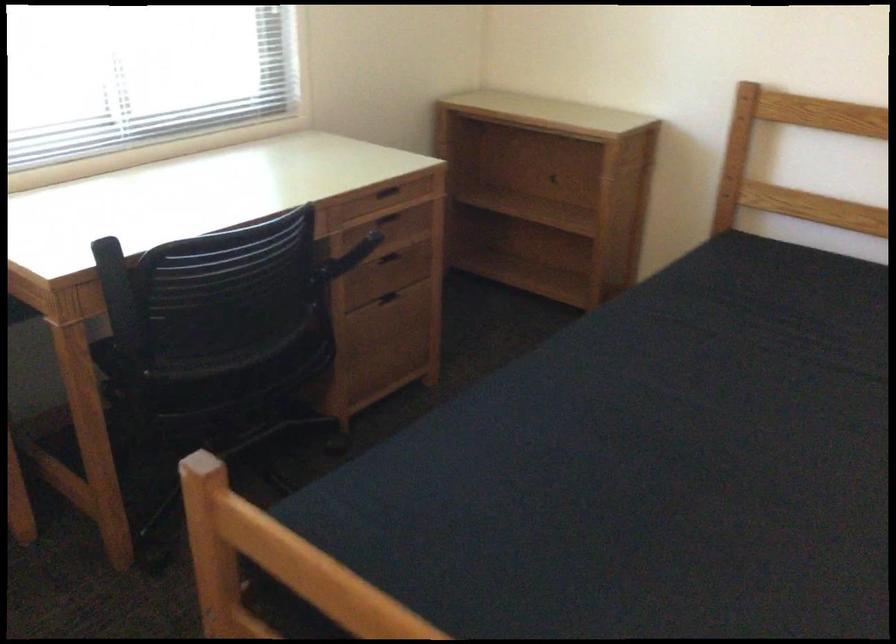
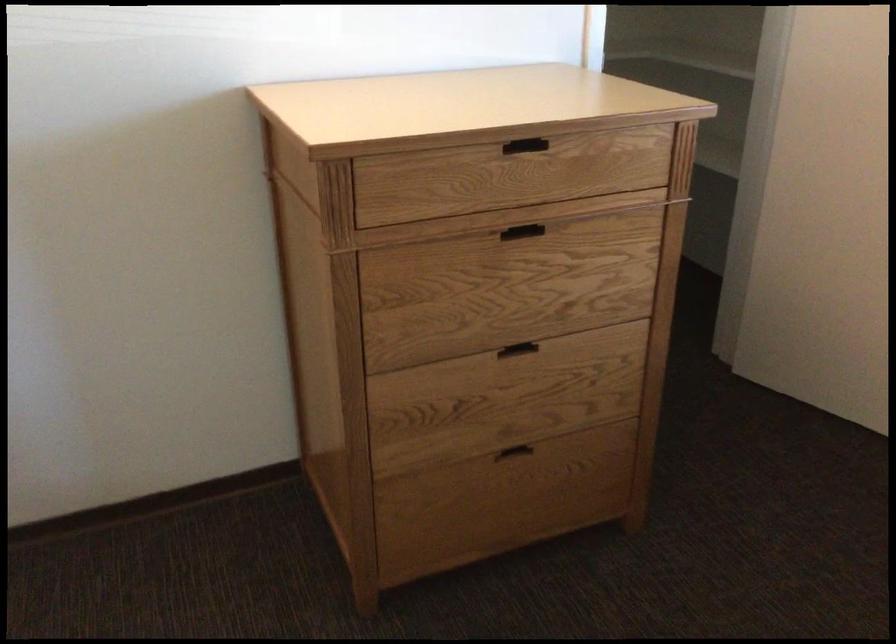
The first image is from the beginning of the video and the second image is from the end. How did the camera likely rotate when shooting the video?

The rotation direction of the camera is left-down.